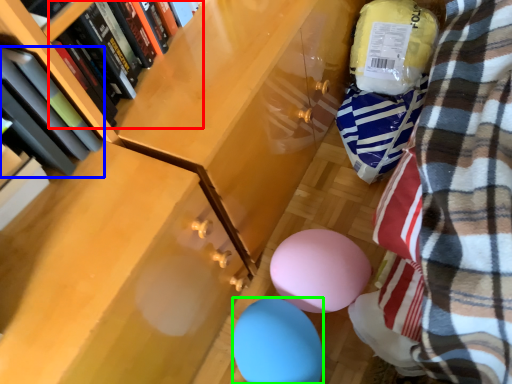
Question: Based on their relative distances, which object is nearer to book (highlighted by a red box)? Choose from book (highlighted by a blue box) and balloon (highlighted by a green box).

Choices:
 (A) book
 (B) balloon

Answer: (A)